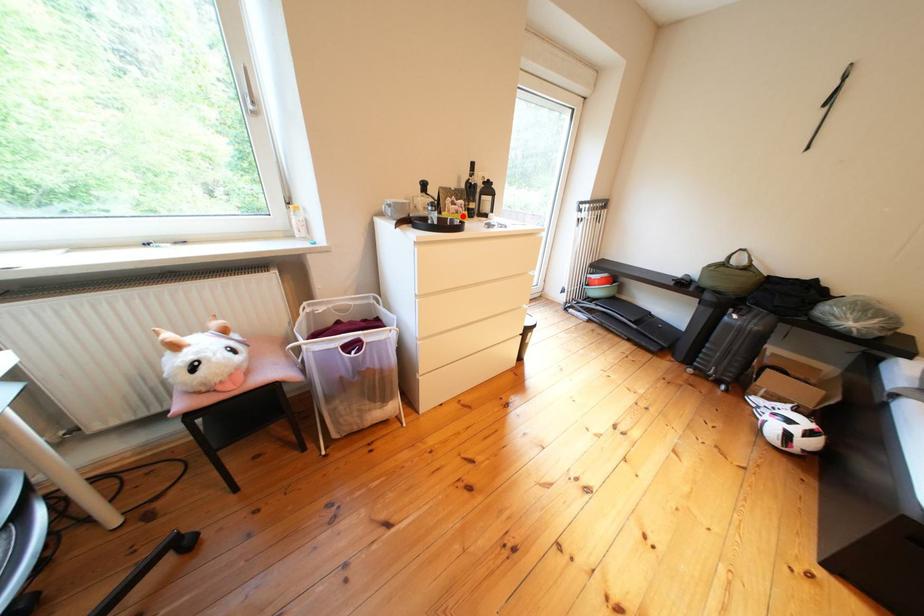
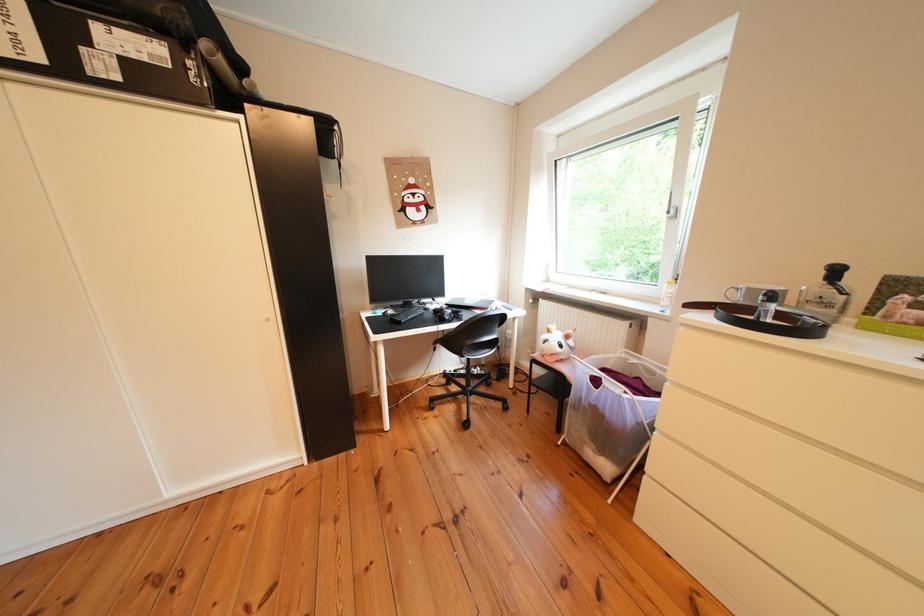
In the second image, find the point that corresponds to the highlighted location in the first image.

(901, 322)